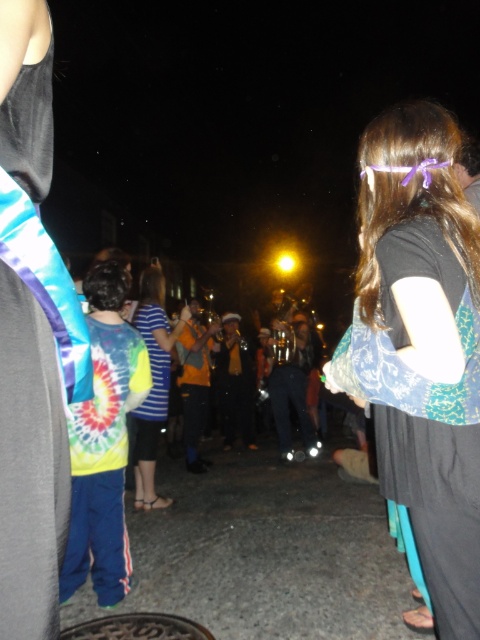
Question: Does black fabric headband at upper right lie in front of striped fabric at center?

Choices:
 (A) yes
 (B) no

Answer: (A)

Question: Which object is farther from the camera taking this photo?

Choices:
 (A) black fabric headband at upper right
 (B) gray metallic manhole cover at lower center

Answer: (B)

Question: Which object is positioned farthest from the black fabric headband at upper right?

Choices:
 (A) gray metallic manhole cover at lower center
 (B) striped fabric at center

Answer: (B)

Question: Can you confirm if black fabric headband at upper right is positioned to the left of gray metallic manhole cover at lower center?

Choices:
 (A) yes
 (B) no

Answer: (B)

Question: Does striped fabric at center appear on the left side of gray metallic manhole cover at lower center?

Choices:
 (A) yes
 (B) no

Answer: (A)

Question: Which object is positioned closest to the gray metallic manhole cover at lower center?

Choices:
 (A) black fabric headband at upper right
 (B) striped fabric at center

Answer: (B)